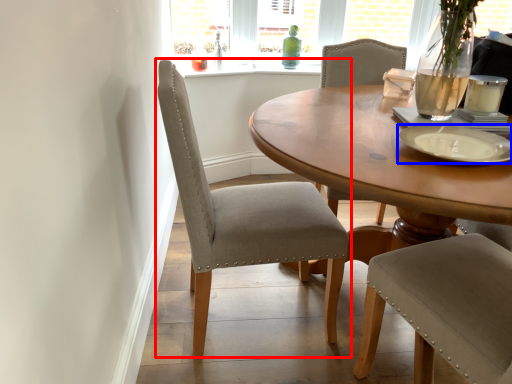
Question: Which point is closer to the camera, chair (highlighted by a red box) or platter (highlighted by a blue box)?

Choices:
 (A) chair
 (B) platter

Answer: (B)